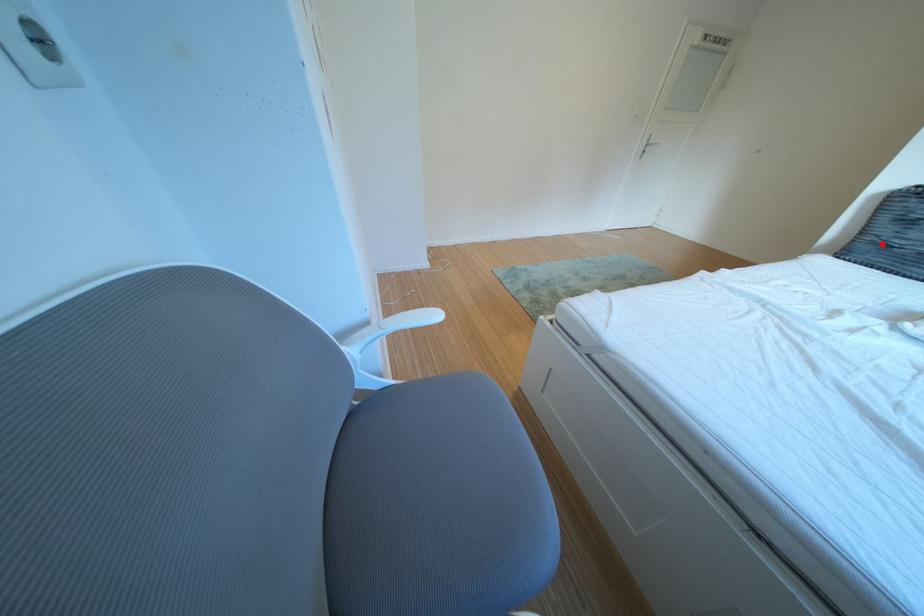
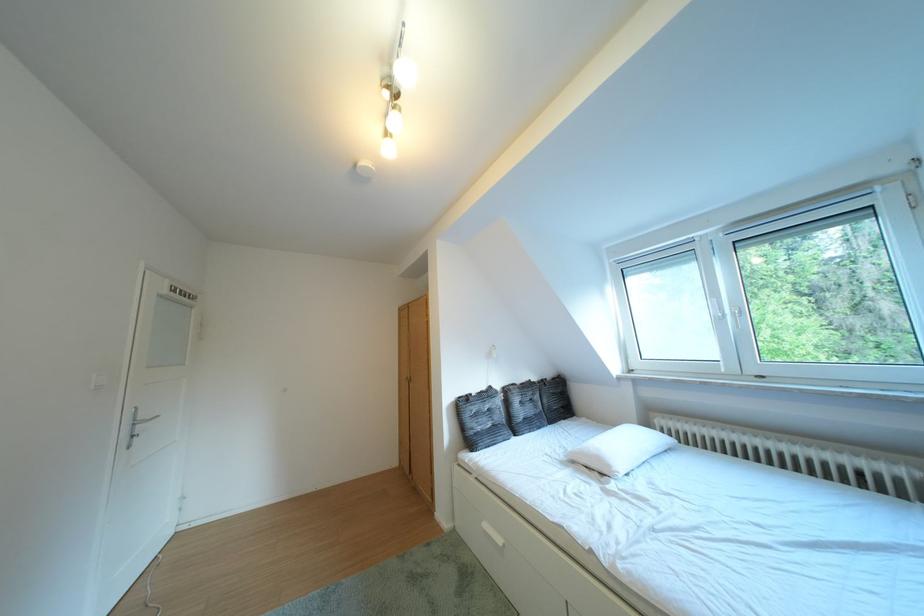
Question: I am providing you with two images of the same scene from different viewpoints. Given a red point in image1, look at the same physical point in image2. Is it:

Choices:
 (A) Closer to the viewpoint
 (B) Farther from the viewpoint

Answer: (A)